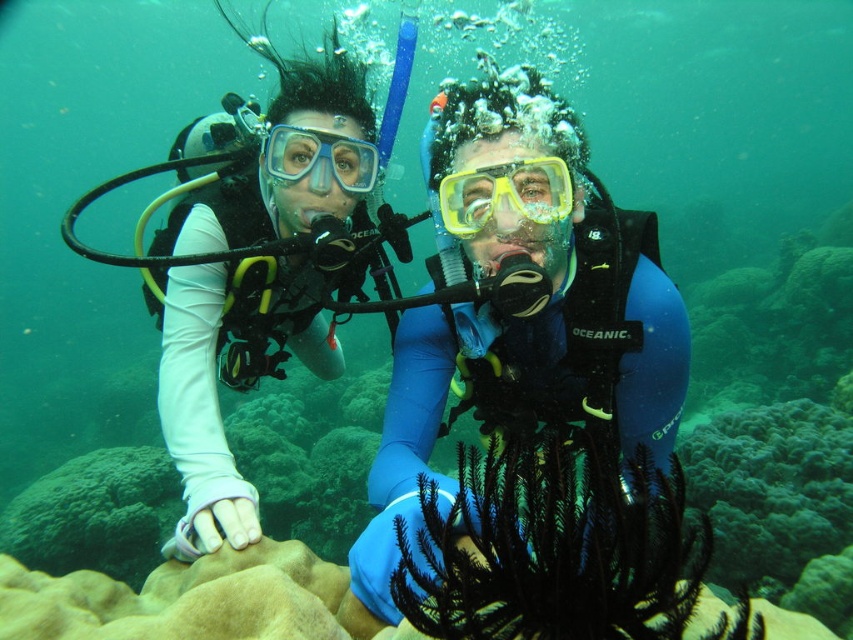
You are a scuba diver planning to swim between the two divers in the image. The point you need to pass through is at coordinates point (265, 145). Given that the distance between them is 7.02 feet, can you safely navigate through this space if your body requires 3 feet of clearance on all sides?

The distance between the two divers is 7.02 feet. To safely navigate between them with 3 feet of clearance on each side, you would need a total of 6 feet of space. Since 7.02 feet is greater than 6 feet, you can safely pass through the space between them.

You are a scuba diver planning to navigate to a specific location marked by a point at coordinates (231, 378). Based on the image, which object is located exactly at this point?

The white matte diving suit at upper left is located at point (231, 378).

You are a scuba diver planning to navigate to the blue rubber suit at center. Given that the coordinates of the blue rubber suit at center are at point (524,317), can you estimate its position relative to the center of the image?

The blue rubber suit at center is located at point (524,317), which is very close to the center of the image since the coordinates are nearly 0.5 in both x and y axes.